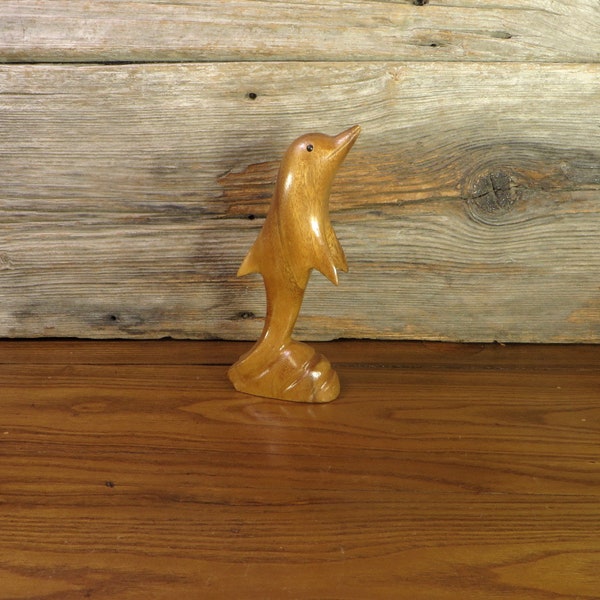
Locate an element on the screen. This screenshot has width=600, height=600. wooden table is located at coordinates (302, 450).